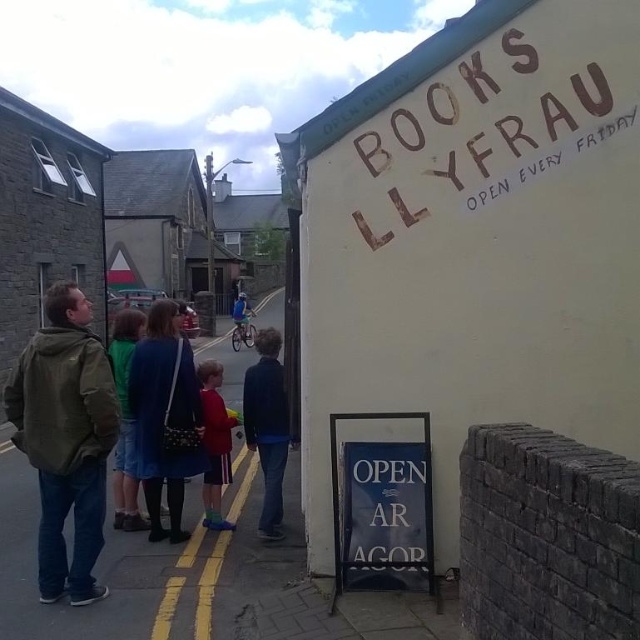
Between olive-green jacket at left and yellow painted line at center, which one has more height?

Standing taller between the two is olive-green jacket at left.

Does olive-green jacket at left lie behind yellow painted line at center?

Yes.

Describe the element at coordinates (65, 440) in the screenshot. I see `olive-green jacket at left` at that location.

Where is `olive-green jacket at left`? The height and width of the screenshot is (640, 640). olive-green jacket at left is located at coordinates (65, 440).

What are the coordinates of `olive-green jacket at left` in the screenshot? It's located at (65, 440).

Who is more distant from viewer, (x=70, y=445) or (x=109, y=346)?

Point (x=109, y=346)

The height and width of the screenshot is (640, 640). Identify the location of olive-green jacket at left. (65, 440).

Does white painted sign at upper right appear on the right side of red fabric bag at center?

Yes, white painted sign at upper right is to the right of red fabric bag at center.

Is point (531, 372) less distant than point (166, 609)?

No.

Where is `white painted sign at upper right`? Image resolution: width=640 pixels, height=640 pixels. white painted sign at upper right is located at coordinates (476, 243).